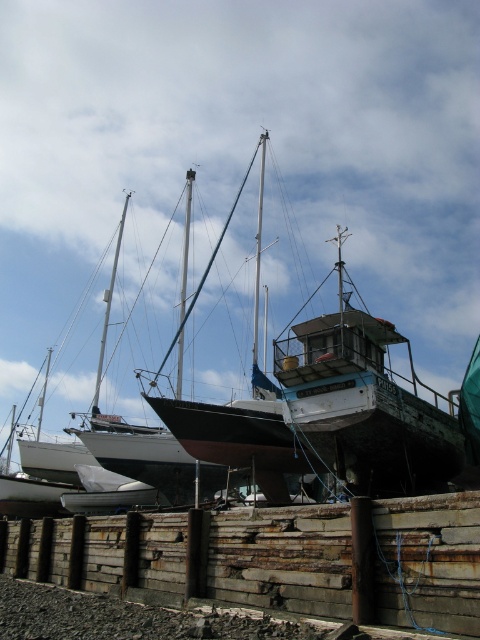
Is rusty wood dock at lower center below black matte sailboat at center?

Yes.

Where is `rusty wood dock at lower center`? The image size is (480, 640). rusty wood dock at lower center is located at coordinates (196, 556).

This screenshot has height=640, width=480. I want to click on rusty wood dock at lower center, so click(196, 556).

Does rusty metal boat at center have a smaller size compared to black matte sailboat at center?

Incorrect, rusty metal boat at center is not smaller in size than black matte sailboat at center.

Is the position of rusty metal boat at center less distant than that of black matte sailboat at center?

Yes, it is.

Is point (330, 333) closer to camera compared to point (275, 444)?

Yes, point (330, 333) is in front of point (275, 444).

Where is `rusty metal boat at center`? The image size is (480, 640). rusty metal boat at center is located at coordinates (362, 404).

Is rusty wood dock at lower center wider than rusty metal boat at center?

In fact, rusty wood dock at lower center might be narrower than rusty metal boat at center.

The height and width of the screenshot is (640, 480). What are the coordinates of `rusty wood dock at lower center` in the screenshot? It's located at pyautogui.click(x=196, y=556).